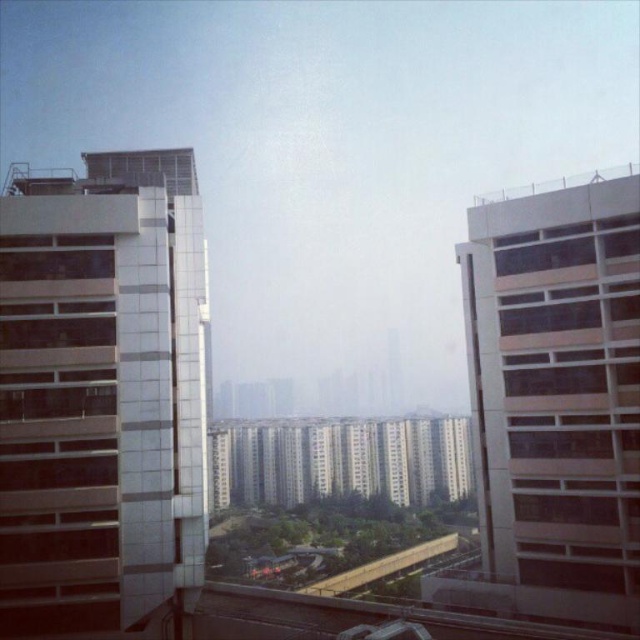
You are a city planner assessing the distance between two key buildings in the urban landscape. The matte beige building at right and the white glossy building at center are both important landmarks. Given that the minimum required distance for emergency vehicle access between any two buildings is 80 meters, does the current spacing between these two buildings meet the safety regulations?

The matte beige building at right and the white glossy building at center are 80.18 meters apart from each other. Since 80.18 meters exceeds the minimum required 80 meters for emergency vehicle access, the current spacing between these two buildings meets the safety regulations.

You are standing at the vantage point looking at the metallic glass building at left and the matte beige building at right. Which building is closer to you?

The metallic glass building at left is closer to you because it is further to the viewer than the matte beige building at right.